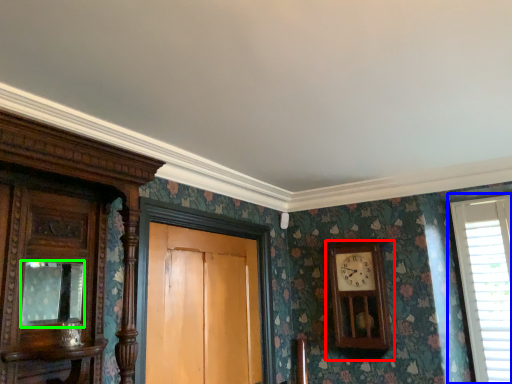
Question: Considering the real-world distances, which object is closest to wall clock (highlighted by a red box)? window (highlighted by a blue box) or mirror (highlighted by a green box).

Choices:
 (A) window
 (B) mirror

Answer: (A)